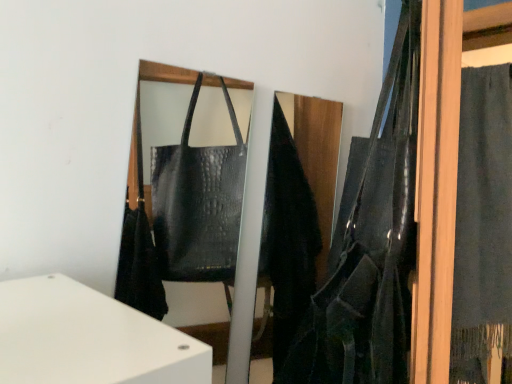
Question: In the image, is dark blue fabric at right positioned in front of or behind leather textured shoulder bag at right?

Choices:
 (A) behind
 (B) front

Answer: (A)

Question: Considering the positions of dark blue fabric at right and leather textured shoulder bag at right in the image, is dark blue fabric at right bigger or smaller than leather textured shoulder bag at right?

Choices:
 (A) small
 (B) big

Answer: (A)

Question: Is dark blue fabric at right wider or thinner than leather textured shoulder bag at right?

Choices:
 (A) wide
 (B) thin

Answer: (A)

Question: Visually, is leather textured shoulder bag at right positioned to the left or to the right of dark blue fabric at right?

Choices:
 (A) left
 (B) right

Answer: (A)

Question: Is leather textured shoulder bag at right wider or thinner than dark blue fabric at right?

Choices:
 (A) wide
 (B) thin

Answer: (B)

Question: Does point (372, 173) appear closer or farther from the camera than point (473, 314)?

Choices:
 (A) closer
 (B) farther

Answer: (A)

Question: Considering their positions, is leather textured shoulder bag at right located in front of or behind dark blue fabric at right?

Choices:
 (A) behind
 (B) front

Answer: (B)